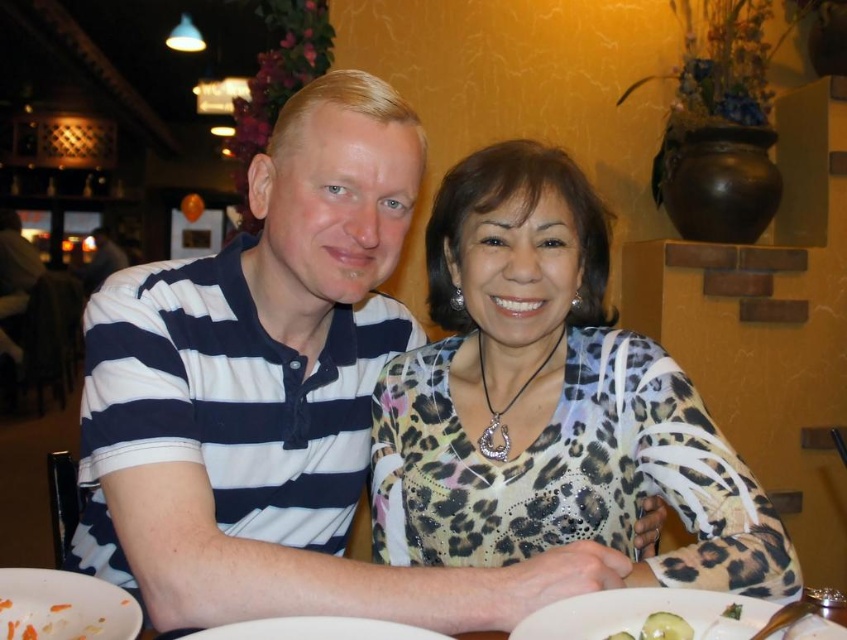
Is white matte plate at lower left bigger than carrot shredded at lower left?

Yes.

Is white matte plate at lower left thinner than carrot shredded at lower left?

In fact, white matte plate at lower left might be wider than carrot shredded at lower left.

Is point (3, 580) positioned before point (34, 604)?

No.

Find the location of a particular element. white matte plate at lower left is located at coordinates (64, 605).

Does white matte plate at lower left appear under white glossy plate at lower center?

Actually, white matte plate at lower left is above white glossy plate at lower center.

Looking at this image, can you confirm if white matte plate at lower left is positioned to the right of white glossy plate at lower center?

In fact, white matte plate at lower left is to the left of white glossy plate at lower center.

Which is in front, point (1, 621) or point (360, 628)?

Point (360, 628) is more forward.

Locate an element on the screen. The image size is (847, 640). white matte plate at lower left is located at coordinates [x=64, y=605].

Does white ceramic plate at lower center lie behind white matte plate at lower left?

Yes, it is behind white matte plate at lower left.

Between point (584, 627) and point (84, 584), which one is positioned in front?

Positioned in front is point (584, 627).

Measure the distance between point (704, 636) and camera.

Point (704, 636) is 26.77 inches from camera.

I want to click on white ceramic plate at lower center, so click(x=645, y=614).